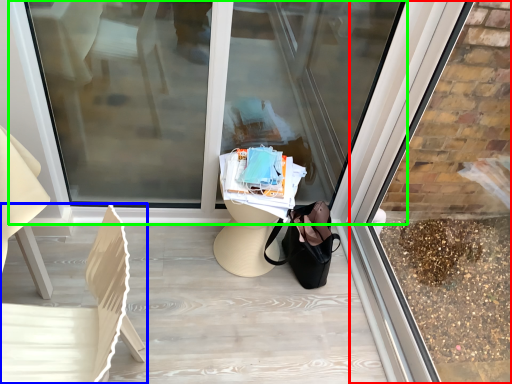
Question: Considering the real-world distances, which object is closest to shop window (highlighted by a red box)? chair (highlighted by a blue box) or shop window (highlighted by a green box).

Choices:
 (A) chair
 (B) shop window

Answer: (B)